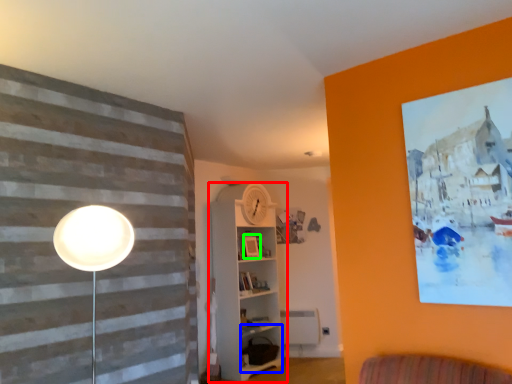
Question: Considering the real-world distances, which object is closest to shelf (highlighted by a red box)? shelf (highlighted by a blue box) or picture frame (highlighted by a green box).

Choices:
 (A) shelf
 (B) picture frame

Answer: (A)